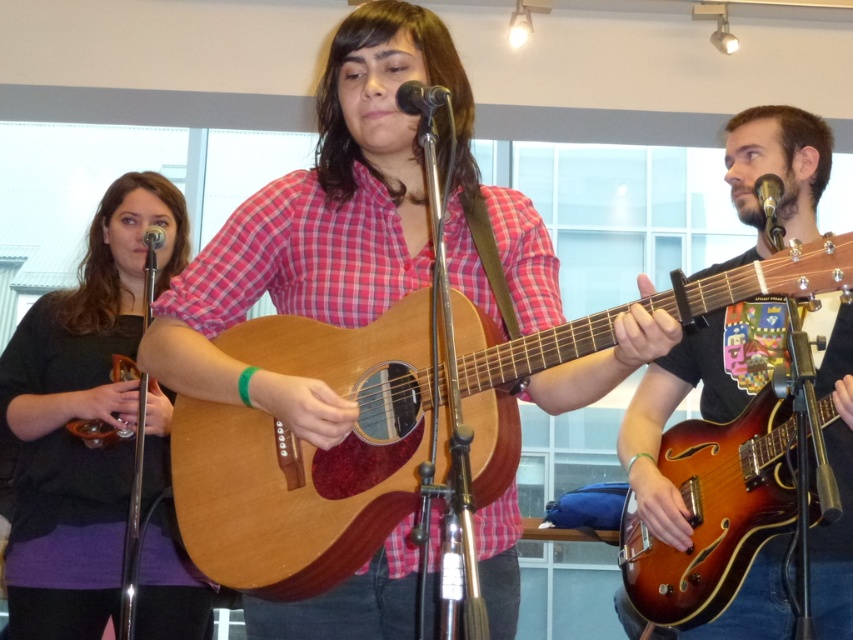
You are standing in front of the musical performance scene. There is a shiny brown guitar at right. Can you reach it without moving your feet?

The shiny brown guitar at right is 5.75 feet away from the viewer, so you cannot reach it without moving your feet since the distance is greater than an average person can reach.

You are standing at the center of the stage and want to move towards the point labeled as point [125,461]. However, there is an obstacle at point [410,112]. Can you reach your destination without passing through the obstacle?

Since point [125,461] is behind point [410,112], you cannot reach the destination without passing through the obstacle at point [410,112].